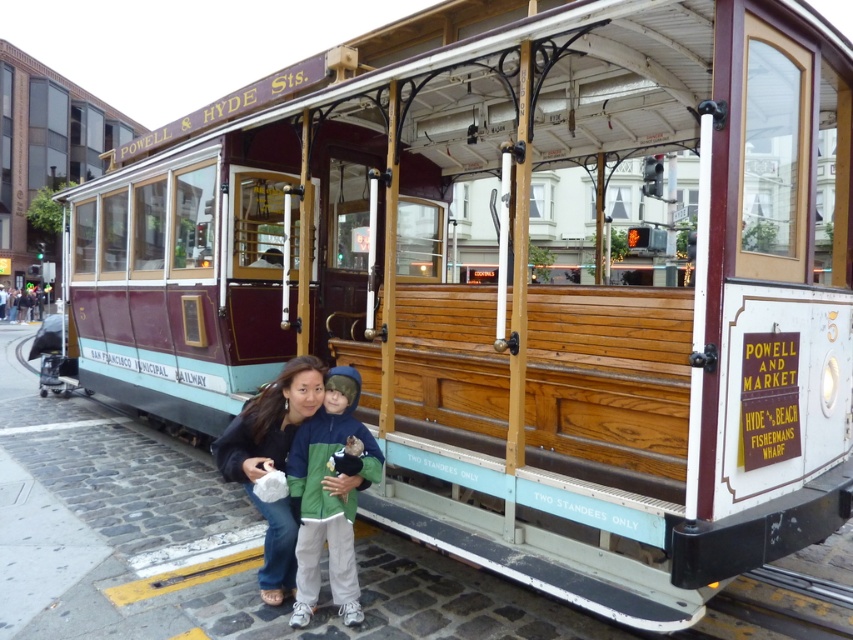
Question: Considering the relative positions of green fleece jacket at center and matte black jacket at lower center in the image provided, where is green fleece jacket at center located with respect to matte black jacket at lower center?

Choices:
 (A) below
 (B) above

Answer: (A)

Question: Which point is farther to the camera?

Choices:
 (A) (270, 529)
 (B) (349, 374)

Answer: (B)

Question: Which point is closer to the camera?

Choices:
 (A) green fleece jacket at center
 (B) matte black jacket at lower center

Answer: (A)

Question: Can you confirm if green fleece jacket at center is wider than matte black jacket at lower center?

Choices:
 (A) no
 (B) yes

Answer: (A)

Question: Can you confirm if green fleece jacket at center is positioned to the right of matte black jacket at lower center?

Choices:
 (A) no
 (B) yes

Answer: (B)